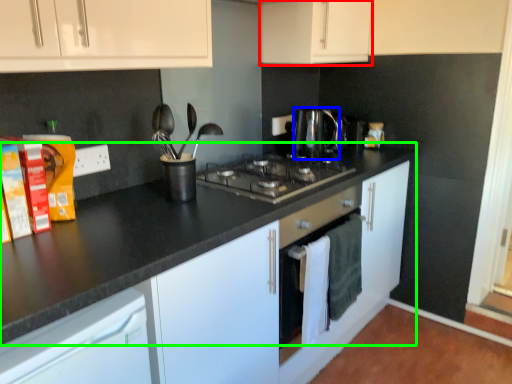
Question: Estimate the real-world distances between objects in this image. Which object is closer to cabinetry (highlighted by a red box), kitchen appliance (highlighted by a blue box) or counter top (highlighted by a green box)?

Choices:
 (A) kitchen appliance
 (B) counter top

Answer: (A)